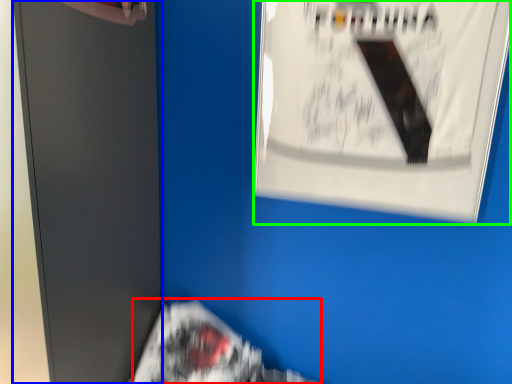
Question: Which object is positioned farthest from flyer (highlighted by a red box)? Select from file cabinet (highlighted by a blue box) and poster (highlighted by a green box).

Choices:
 (A) file cabinet
 (B) poster

Answer: (B)